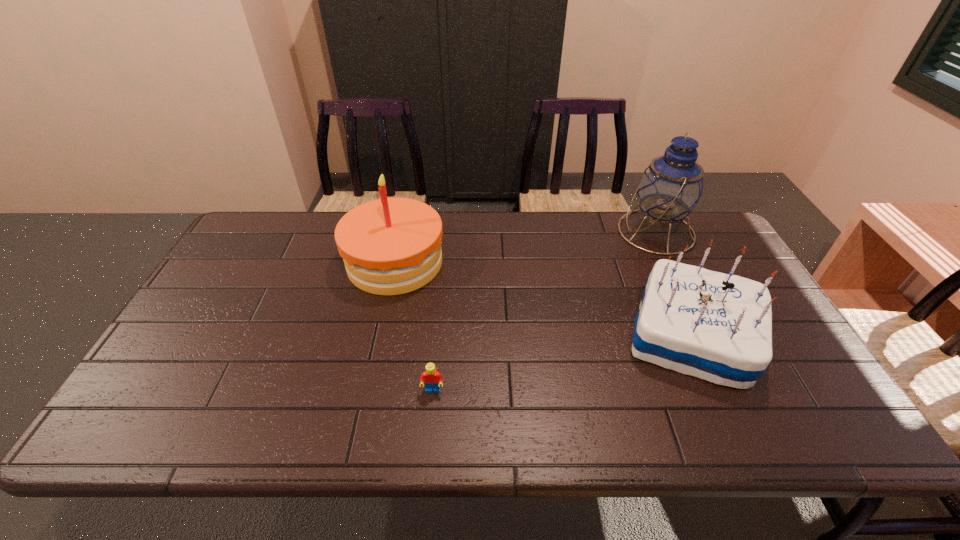
At what (x,y) coordinates should I click in order to perform the action: click on lantern. Please return your answer as a coordinate pair (x, y). Looking at the image, I should click on (x=670, y=188).

I want to click on the taller birthday cake, so click(390, 246).

Find the location of `the shorter birthday cake`. the shorter birthday cake is located at coordinates (714, 326).

Where is `the right birthday cake`? This screenshot has height=540, width=960. the right birthday cake is located at coordinates (714, 326).

The image size is (960, 540). I want to click on the shortest object, so click(433, 378).

Identify the location of vacant area situated on the front-facing side of the lantern. Image resolution: width=960 pixels, height=540 pixels. (536, 232).

You are a GUI agent. You are given a task and a screenshot of the screen. Output one action in this format:
    pyautogui.click(x=<x>, y=<y>)
    Task: Click on the free region located on the front-facing side of the lantern
    This screenshot has height=540, width=960.
    Given the screenshot: What is the action you would take?
    pyautogui.click(x=517, y=232)

The height and width of the screenshot is (540, 960). I want to click on vacant point located on the front-facing side of the lantern, so click(x=499, y=232).

I want to click on vacant point located on the right of the left birthday cake, so click(x=513, y=262).

Image resolution: width=960 pixels, height=540 pixels. In order to click on vacant region located 0.130m on the back of the second shortest object in this screenshot , I will do `click(658, 261)`.